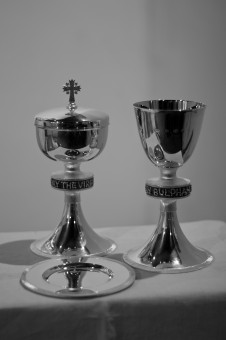
You are a GUI agent. You are given a task and a screenshot of the screen. Output one action in this format:
    pyautogui.click(x=<x>, y=<y>)
    Task: Click on the reflection on silver plate
    This screenshot has width=226, height=340.
    Given the screenshot: What is the action you would take?
    pyautogui.click(x=76, y=274)